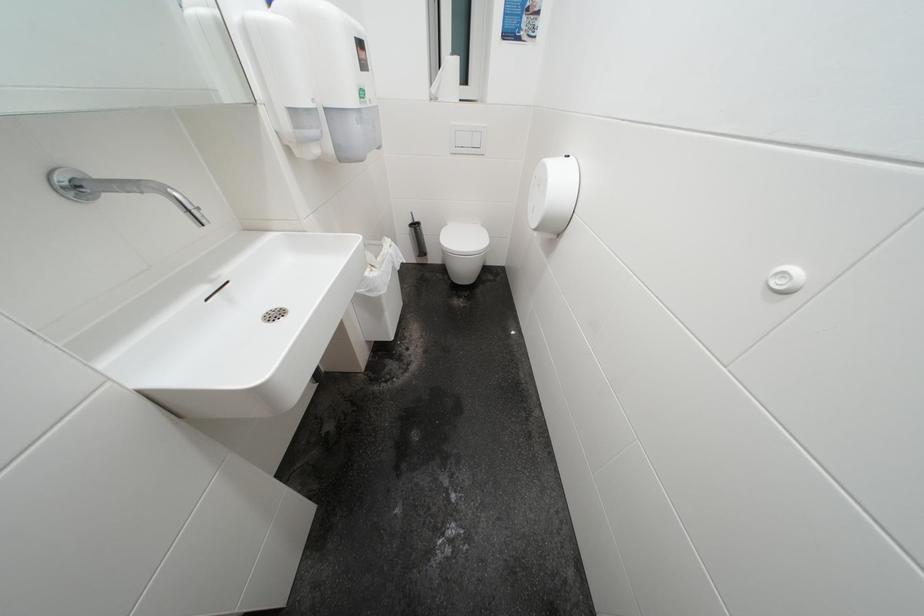
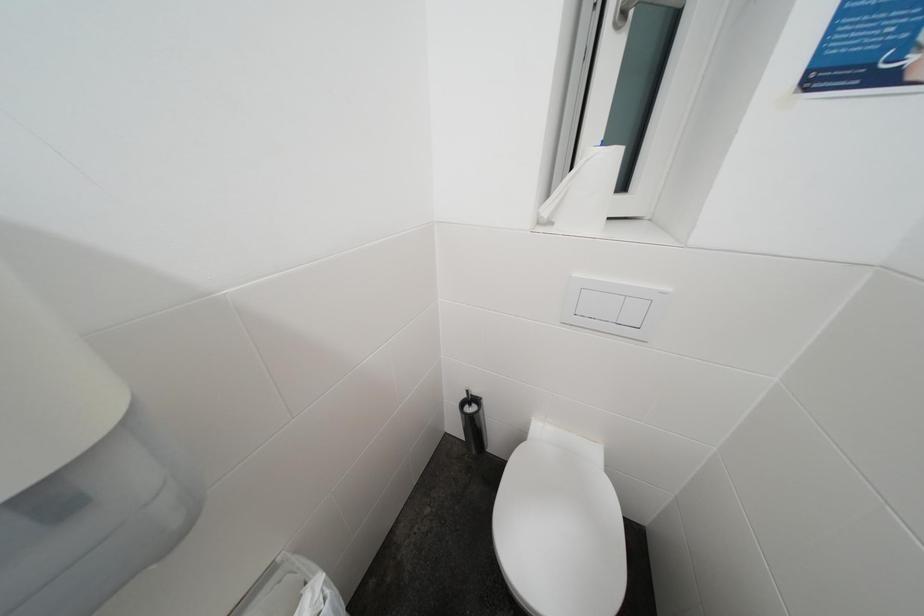
Question: What movement of the cameraman would produce the second image?

Choices:
 (A) Left
 (B) Right
 (C) Forward
 (D) Backward

Answer: (C)